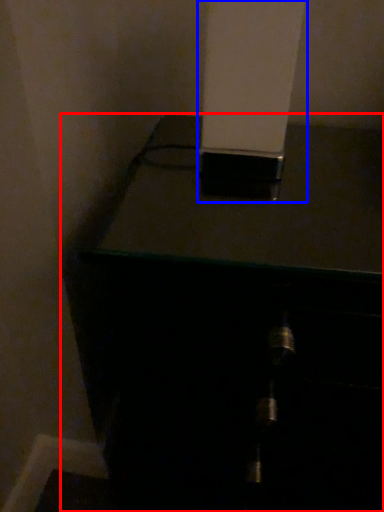
Question: Which of the following is the closest to the observer, furniture (highlighted by a red box) or pillar (highlighted by a blue box)?

Choices:
 (A) furniture
 (B) pillar

Answer: (B)